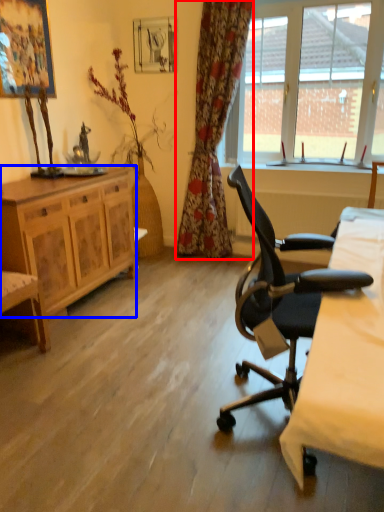
Question: Which point is further to the camera, curtain (highlighted by a red box) or cabinetry (highlighted by a blue box)?

Choices:
 (A) curtain
 (B) cabinetry

Answer: (A)